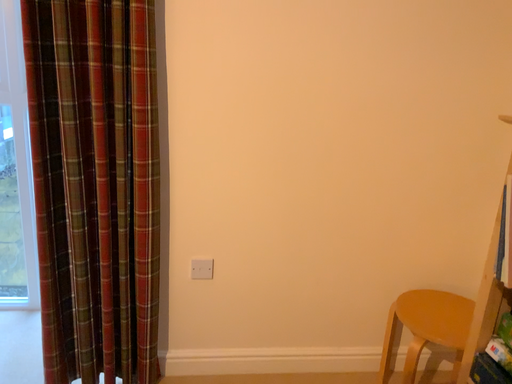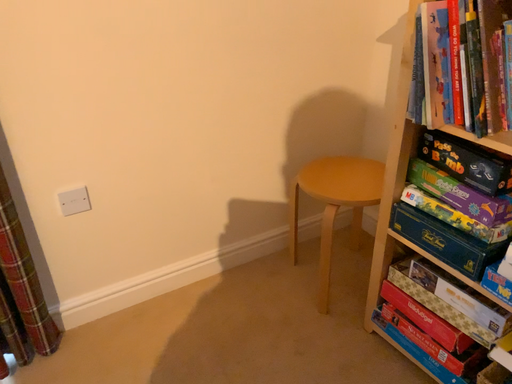
Question: How did the camera likely rotate when shooting the video?

Choices:
 (A) rotated upward
 (B) rotated downward

Answer: (B)